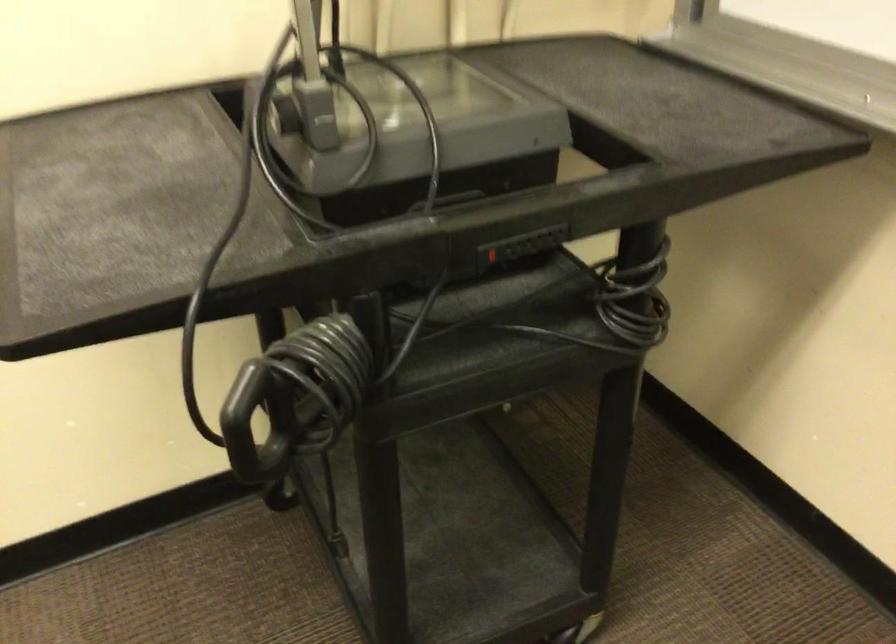
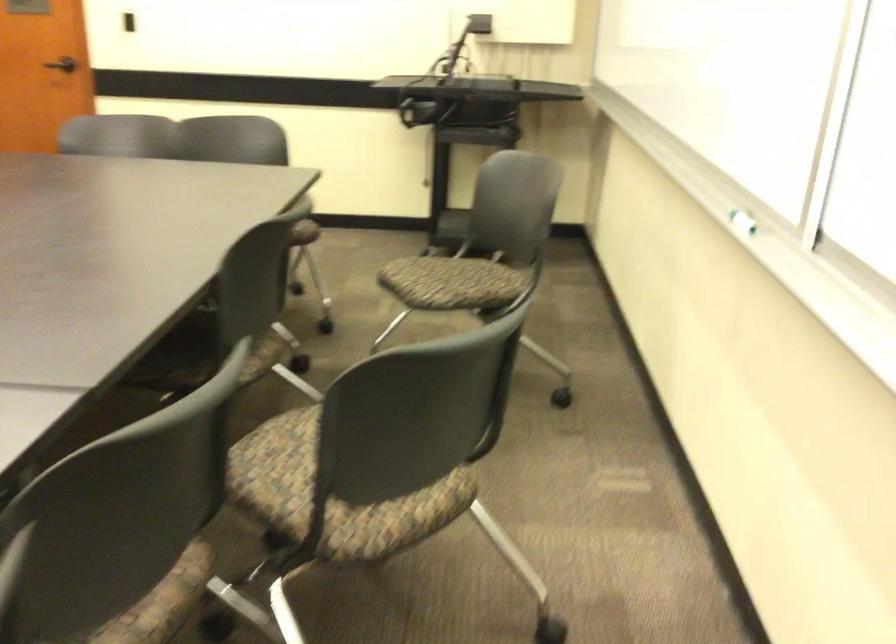
Which direction would the cameraman need to move to produce the second image?

The cameraman walked toward right, backward.